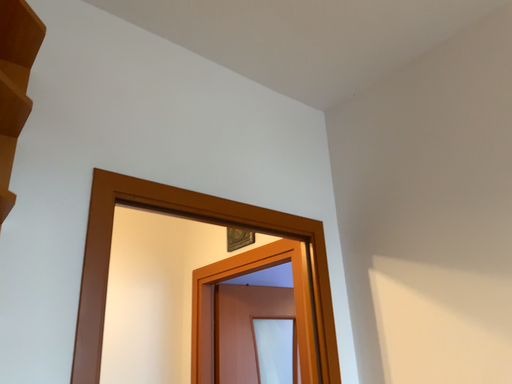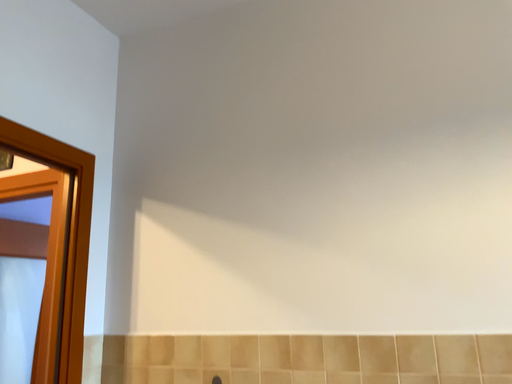
Question: How did the camera likely rotate when shooting the video?

Choices:
 (A) rotated downward
 (B) rotated upward

Answer: (A)